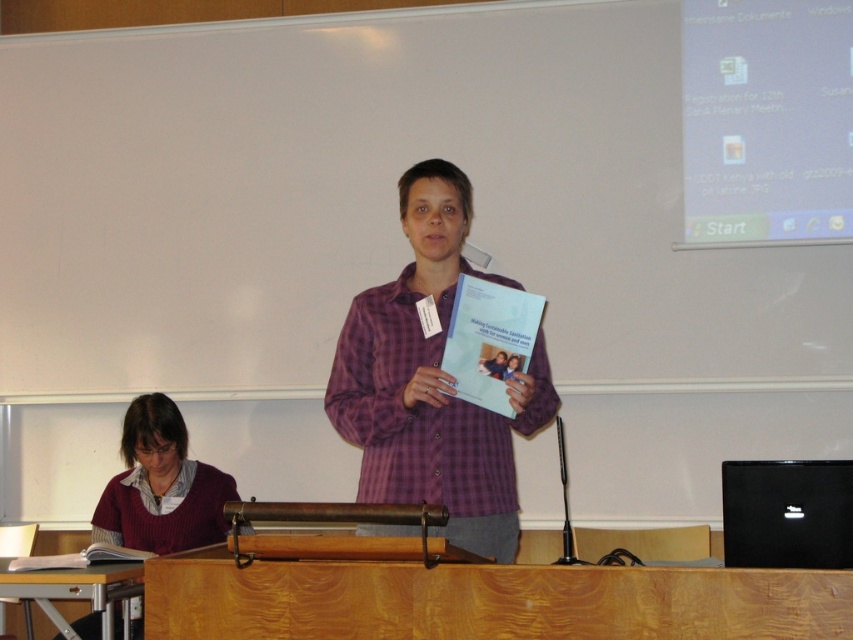
You are a photographer trying to capture a photo of the purple checkered shirt at center and the maroon sweater at lower left. If you want to ensure both are fully visible in the frame, should you adjust the camera to focus on the wider object first?

The purple checkered shirt at center might be wider than maroon sweater at lower left, so you should focus on the purple checkered shirt at center first to ensure it fits in the frame.

You are organizing a school event and need to decide which of the two clothing items, the purple checkered shirt at center or the maroon sweater at lower left, would be more suitable for a large group photo where visibility is important. Based on their sizes, which one would stand out more?

The purple checkered shirt at center is larger in size than the maroon sweater at lower left, so it would stand out more in the group photo.

Based on the coordinates provided, which object is located at point (432, 381) in the classroom scene?

The point (432, 381) marks the purple checkered shirt at center.